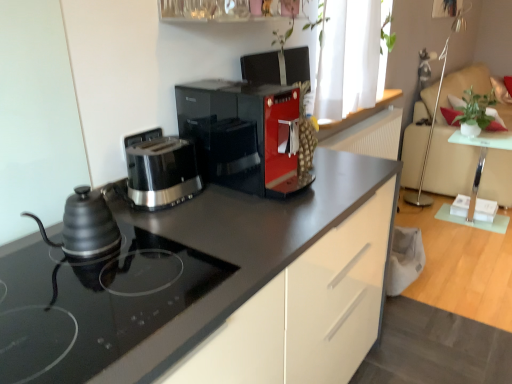
The height and width of the screenshot is (384, 512). I want to click on blank space situated above black matte kettle at left (from a real-world perspective), so click(x=94, y=285).